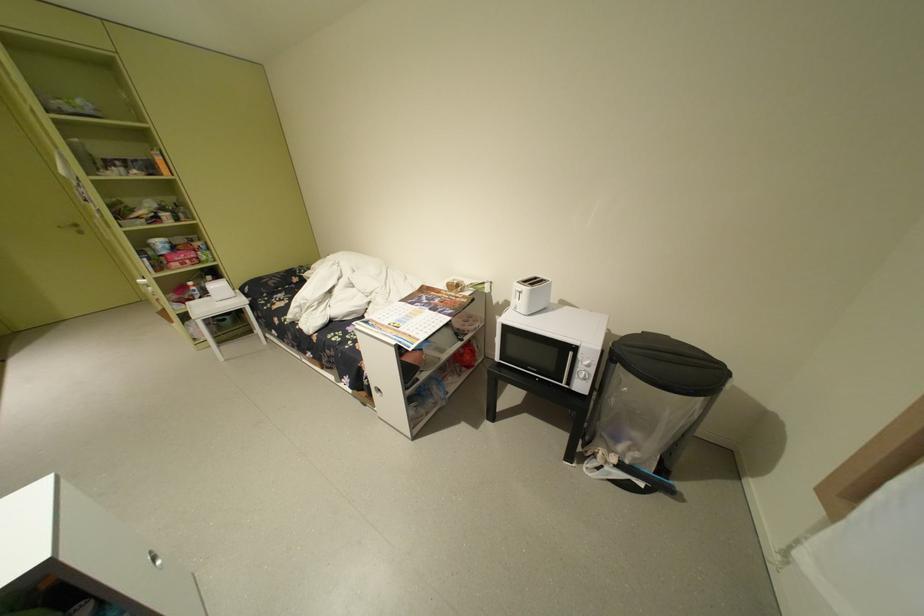
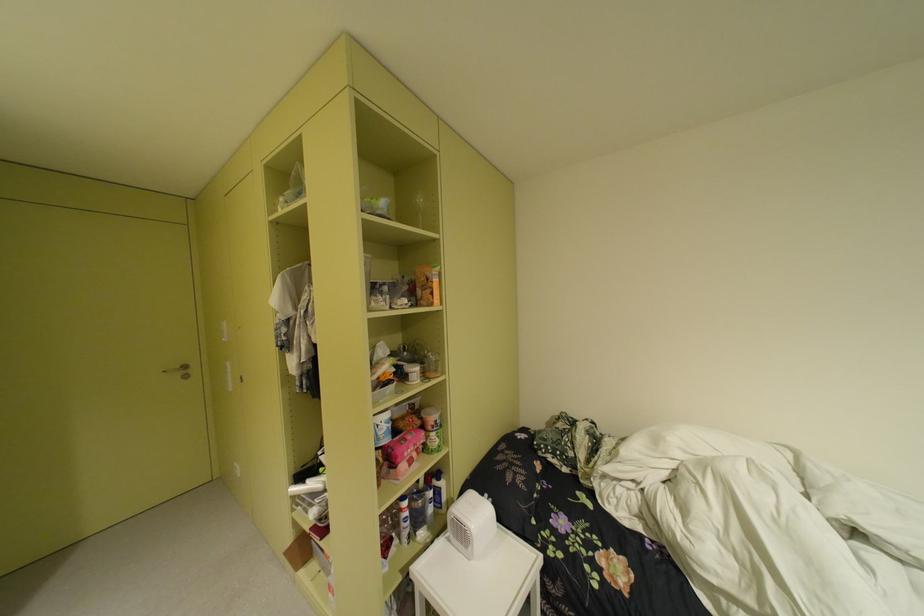
Where in the second image is the point corresponding to point 188,220 from the first image?

(434, 376)